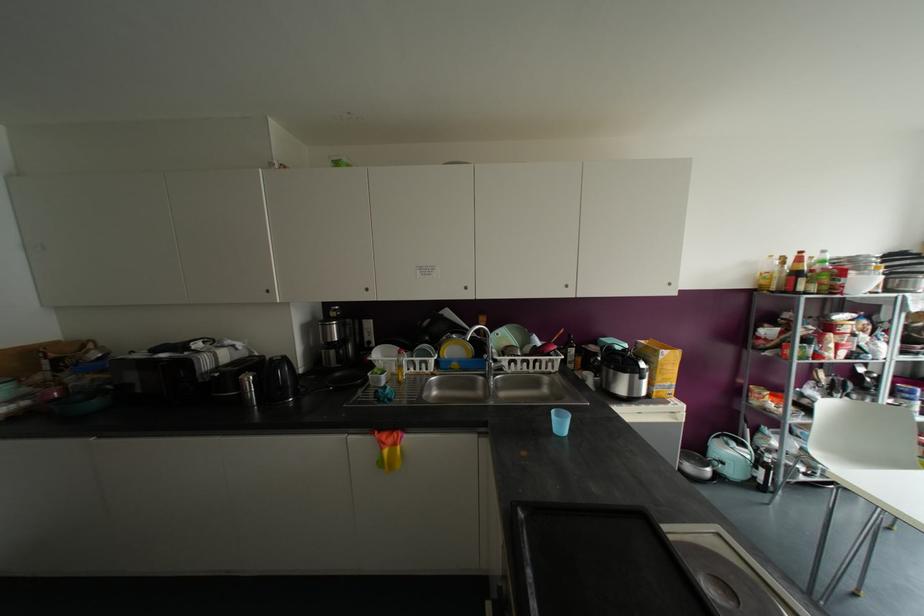
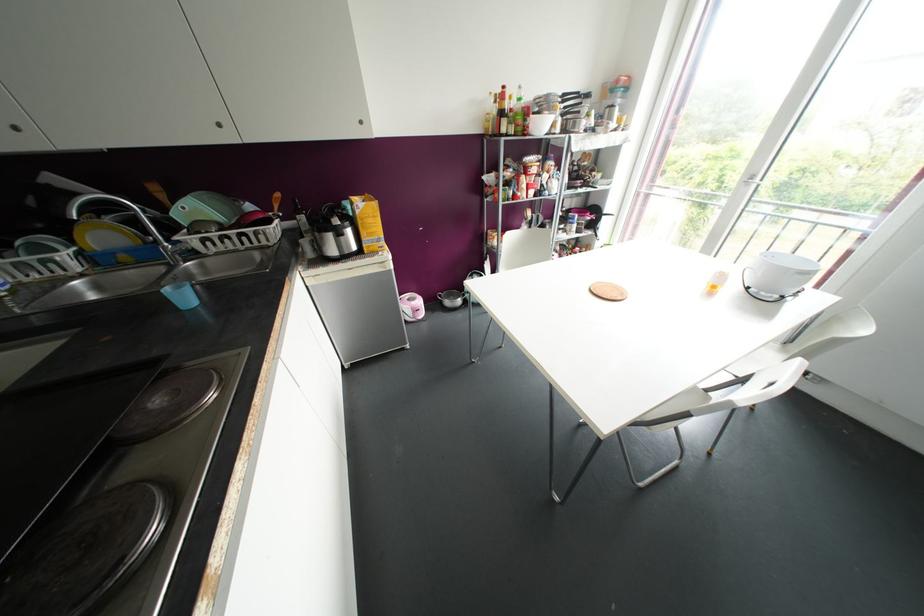
Locate, in the second image, the point that corresponds to point (669, 367) in the first image.

(370, 220)